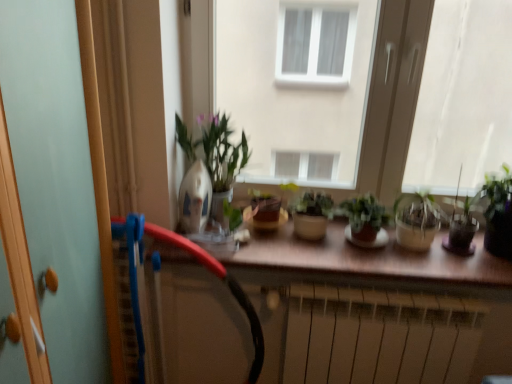
In order to click on vacant area that is in front of green matte plant at center, the 2th houseplant viewed from the left in this screenshot , I will do `click(375, 267)`.